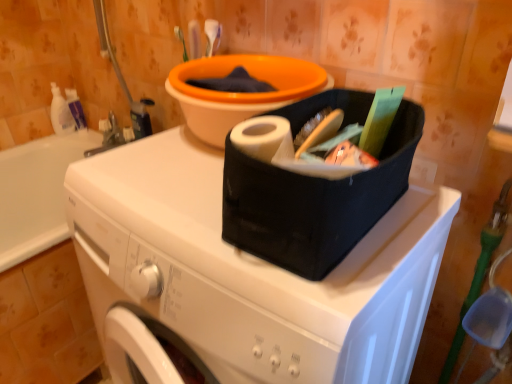
Question: Is the depth of white glossy bottle at left, the 2th cleaning product viewed from the right, less than that of white matte washing machine at center?

Choices:
 (A) yes
 (B) no

Answer: (B)

Question: From a real-world perspective, is white glossy bottle at left, the 2th cleaning product viewed from the right, positioned under white matte washing machine at center based on gravity?

Choices:
 (A) yes
 (B) no

Answer: (B)

Question: Can you see white glossy bottle at left, marked as the 1th cleaning product in a left-to-right arrangement, touching white matte washing machine at center?

Choices:
 (A) no
 (B) yes

Answer: (A)

Question: Is white glossy bottle at left, marked as the 1th cleaning product in a left-to-right arrangement, not near white matte washing machine at center?

Choices:
 (A) no
 (B) yes

Answer: (B)

Question: Considering the relative sizes of white glossy bottle at left, the 2th cleaning product viewed from the right, and white matte washing machine at center in the image provided, is white glossy bottle at left, the 2th cleaning product viewed from the right, bigger than white matte washing machine at center?

Choices:
 (A) yes
 (B) no

Answer: (B)

Question: Based on their sizes in the image, would you say white glossy bottle at left, marked as the 1th cleaning product in a left-to-right arrangement, is bigger or smaller than white plastic bottle at upper left, which is the 2th cleaning product in left-to-right order?

Choices:
 (A) big
 (B) small

Answer: (A)

Question: Is white glossy bottle at left, marked as the 1th cleaning product in a left-to-right arrangement, in front of or behind white plastic bottle at upper left, marked as the 1th cleaning product in a right-to-left arrangement, in the image?

Choices:
 (A) behind
 (B) front

Answer: (B)

Question: Is white glossy bottle at left, the 2th cleaning product viewed from the right, taller or shorter than white plastic bottle at upper left, which is the 2th cleaning product in left-to-right order?

Choices:
 (A) tall
 (B) short

Answer: (A)

Question: Would you say white glossy bottle at left, the 2th cleaning product viewed from the right, is to the left or to the right of white plastic bottle at upper left, marked as the 1th cleaning product in a right-to-left arrangement, in the picture?

Choices:
 (A) left
 (B) right

Answer: (A)

Question: From the image's perspective, is white plastic bottle at upper left, which is the 2th cleaning product in left-to-right order, above or below white matte washing machine at center?

Choices:
 (A) below
 (B) above

Answer: (B)

Question: Considering the positions of white plastic bottle at upper left, marked as the 1th cleaning product in a right-to-left arrangement, and white matte washing machine at center in the image, is white plastic bottle at upper left, marked as the 1th cleaning product in a right-to-left arrangement, taller or shorter than white matte washing machine at center?

Choices:
 (A) short
 (B) tall

Answer: (A)

Question: Relative to white matte washing machine at center, is white plastic bottle at upper left, which is the 2th cleaning product in left-to-right order, in front or behind?

Choices:
 (A) behind
 (B) front

Answer: (A)

Question: Is white plastic bottle at upper left, marked as the 1th cleaning product in a right-to-left arrangement, to the left or to the right of white matte washing machine at center in the image?

Choices:
 (A) left
 (B) right

Answer: (A)

Question: Considering the relative positions of white matte washing machine at center and white plastic bottle at upper left, which is the 2th cleaning product in left-to-right order, in the image provided, is white matte washing machine at center to the left or to the right of white plastic bottle at upper left, which is the 2th cleaning product in left-to-right order,?

Choices:
 (A) left
 (B) right

Answer: (B)

Question: Is white matte washing machine at center in front of or behind white plastic bottle at upper left, which is the 2th cleaning product in left-to-right order, in the image?

Choices:
 (A) behind
 (B) front

Answer: (B)